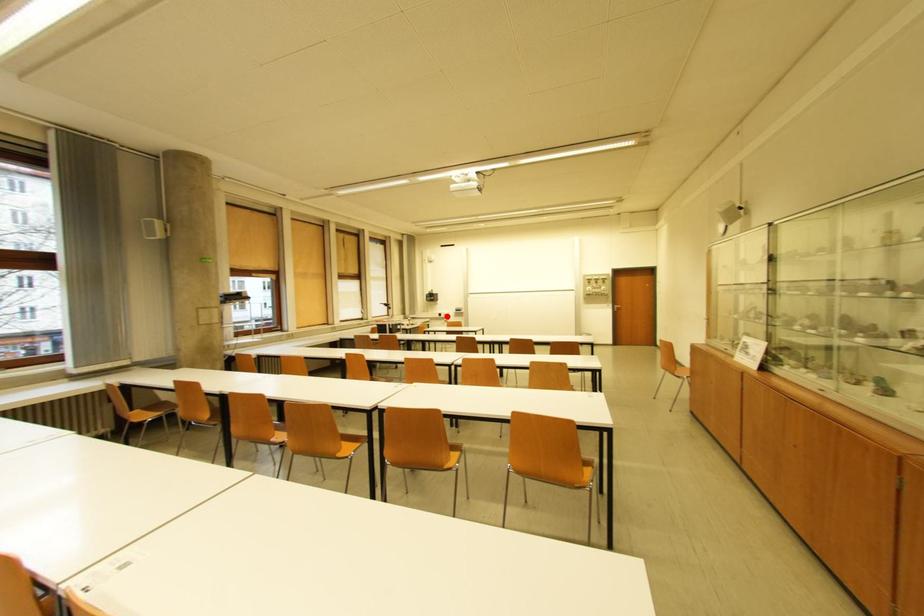
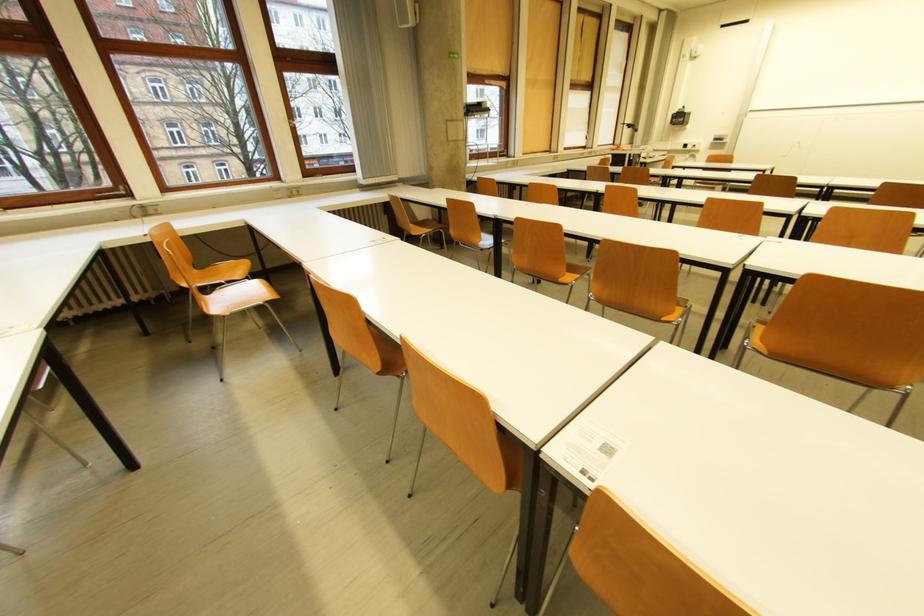
Locate, in the second image, the point that corresponds to the highlighted location in the first image.

(691, 147)